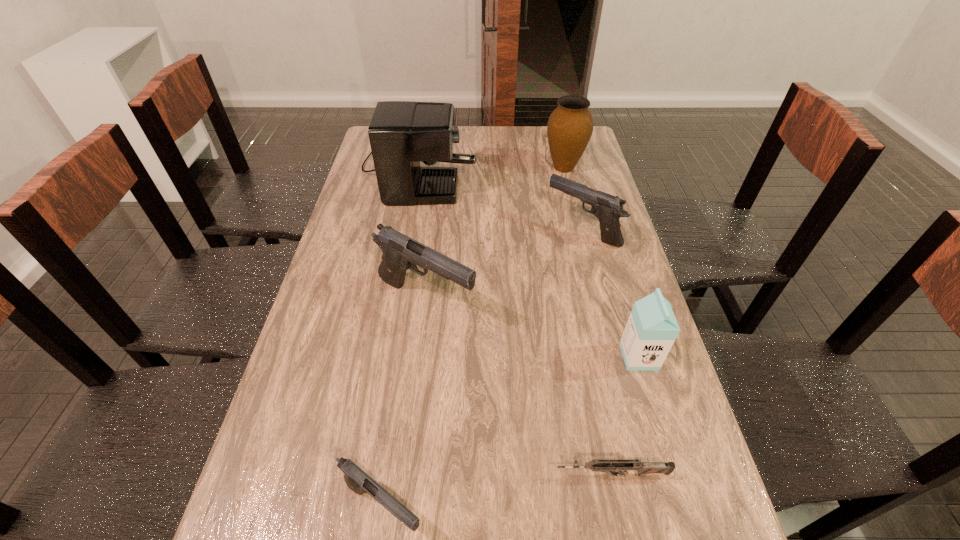
Identify which gun is the second nearest to the third nearest object. Please provide its 2D coordinates. Your answer should be formatted as a tuple, i.e. [(x, y)], where the tuple contains the x and y coordinates of a point satisfying the conditions above.

[(608, 209)]

Identify which gun is the fourth nearest to the milk carton. Please provide its 2D coordinates. Your answer should be formatted as a tuple, i.e. [(x, y)], where the tuple contains the x and y coordinates of a point satisfying the conditions above.

[(357, 480)]

Select which black gun is the closest to the tallest gun. Please provide its 2D coordinates. Your answer should be formatted as a tuple, i.e. [(x, y)], where the tuple contains the x and y coordinates of a point satisfying the conditions above.

[(608, 209)]

Locate an element on the screen. The height and width of the screenshot is (540, 960). black gun identified as the closest to the urn is located at coordinates (608, 209).

What are the coordinates of `free spot that satisfies the following two spatial constraints: 1. on the back side of the fifth farthest object; 2. at the muzzle of the farthest gun` in the screenshot? It's located at (602, 231).

Where is `free spot that satisfies the following two spatial constraints: 1. at the muzzle of the third nearest object; 2. on the left side of the farthest gun`? The height and width of the screenshot is (540, 960). free spot that satisfies the following two spatial constraints: 1. at the muzzle of the third nearest object; 2. on the left side of the farthest gun is located at coordinates (613, 356).

Locate an element on the screen. The height and width of the screenshot is (540, 960). vacant space that satisfies the following two spatial constraints: 1. on the front-facing side of the black coffee maker; 2. on the left side of the fifth farthest object is located at coordinates (387, 356).